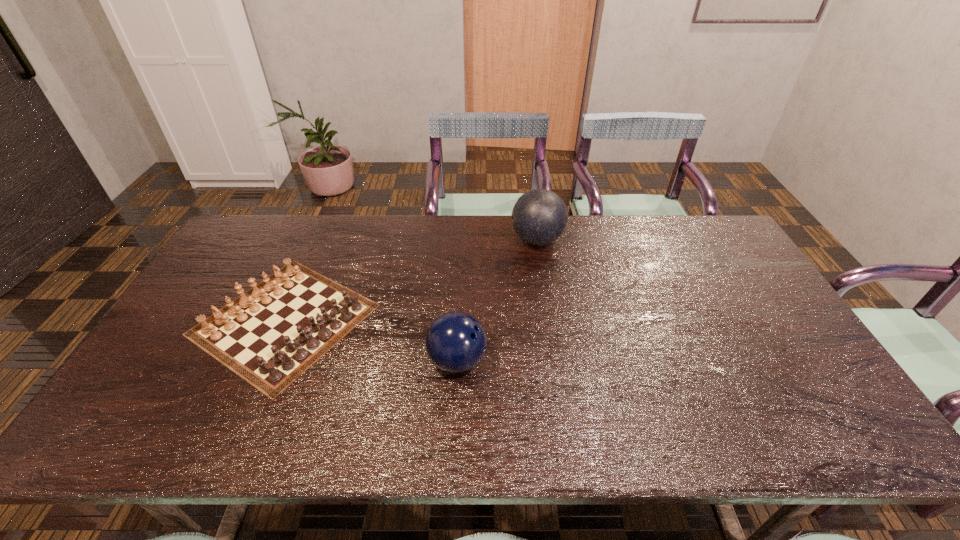
Where is `empty space that is in between the chessboard and the rightmost object`? Image resolution: width=960 pixels, height=540 pixels. empty space that is in between the chessboard and the rightmost object is located at coordinates (411, 279).

Where is `free space between the right bowling ball and the shorter bowling ball`? The height and width of the screenshot is (540, 960). free space between the right bowling ball and the shorter bowling ball is located at coordinates (497, 300).

You are a GUI agent. You are given a task and a screenshot of the screen. Output one action in this format:
    pyautogui.click(x=<x>, y=<y>)
    Task: Click on the free space between the chessboard and the farther bowling ball
    This screenshot has height=540, width=960.
    Given the screenshot: What is the action you would take?
    point(411,279)

Locate an element on the screen. This screenshot has width=960, height=540. vacant point located between the left bowling ball and the rightmost object is located at coordinates pos(497,300).

I want to click on free space between the shorter bowling ball and the farther bowling ball, so click(x=497, y=300).

I want to click on empty space that is in between the farther bowling ball and the chessboard, so click(x=411, y=279).

This screenshot has height=540, width=960. I want to click on empty space between the chessboard and the left bowling ball, so coord(371,340).

Locate an element on the screen. The height and width of the screenshot is (540, 960). vacant space that's between the shortest object and the shorter bowling ball is located at coordinates (371, 340).

Choose which object is the second nearest neighbor to the leftmost object. Please provide its 2D coordinates. Your answer should be formatted as a tuple, i.e. [(x, y)], where the tuple contains the x and y coordinates of a point satisfying the conditions above.

[(539, 217)]

I want to click on object that can be found as the closest to the leftmost object, so click(455, 342).